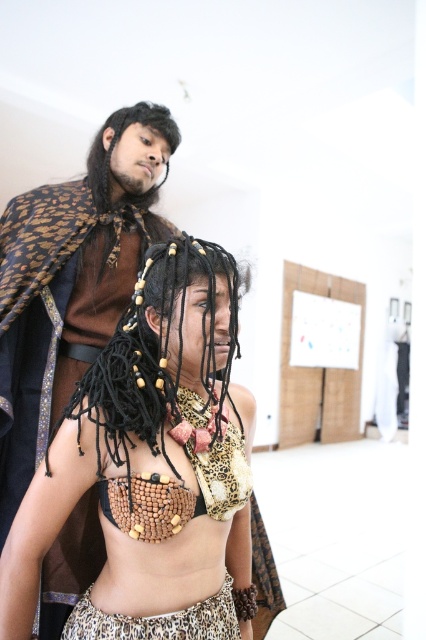
Who is more forward, (146, 298) or (164, 316)?

Point (164, 316) is in front.

Does wooden beads necklace at center appear under black beaded hair at center?

Yes, wooden beads necklace at center is below black beaded hair at center.

Describe the element at coordinates (152, 465) in the screenshot. This screenshot has width=426, height=640. I see `wooden beads necklace at center` at that location.

The width and height of the screenshot is (426, 640). I want to click on wooden beads necklace at center, so click(x=152, y=465).